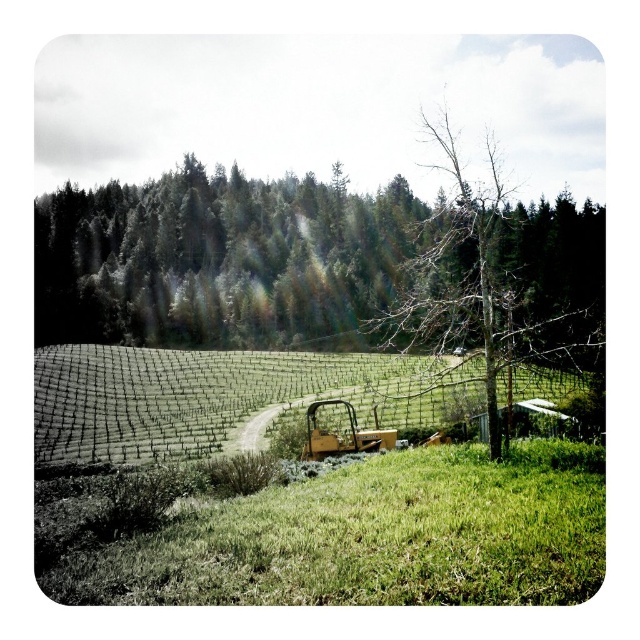
You are standing at the origin point of the coordinate system in the image. You want to walk towards the green netting at center. What direction should you walk in?

You should walk towards the point with coordinates 0.620 in the x direction and 0.347 in the y direction to reach the green netting at center.